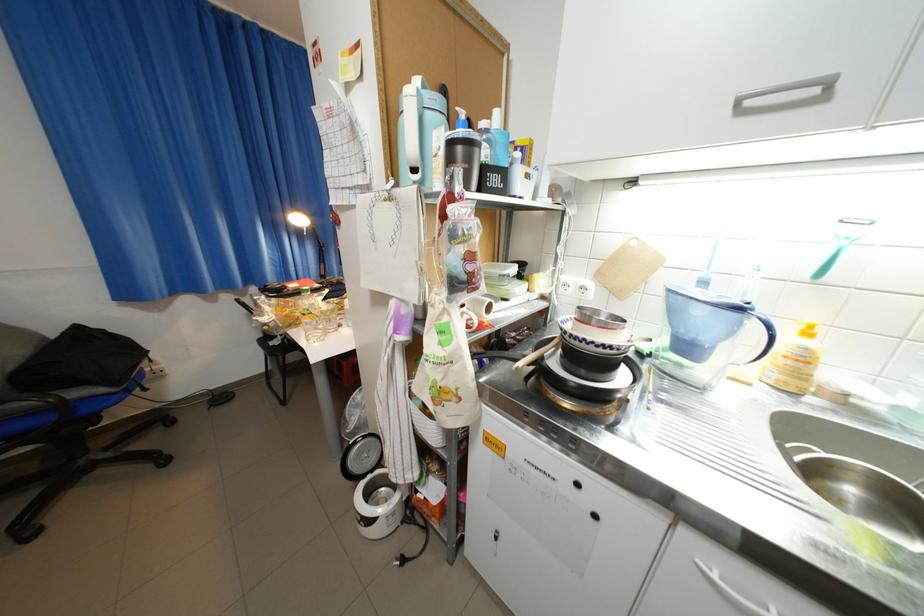
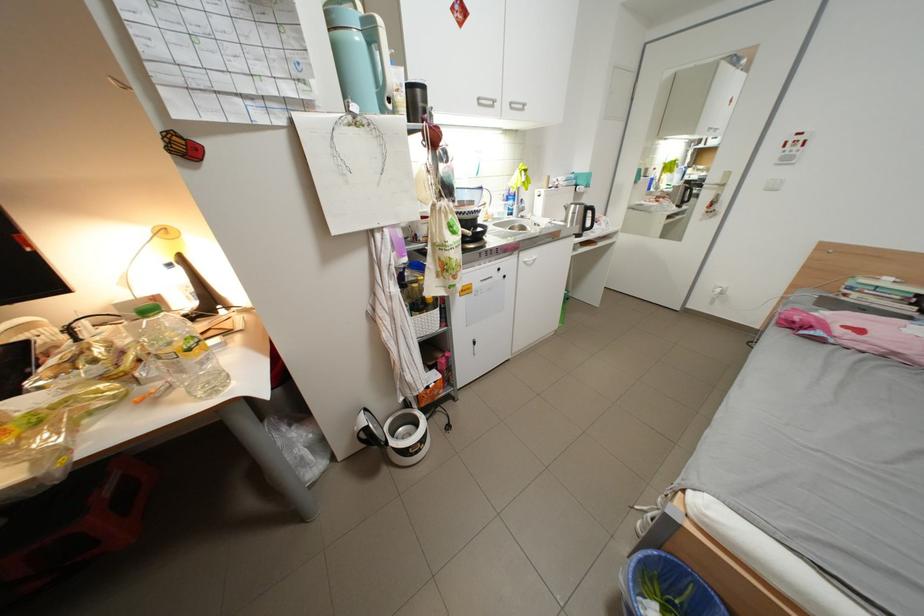
Locate, in the second image, the point that corresponds to (x=750, y=103) in the first image.

(490, 100)